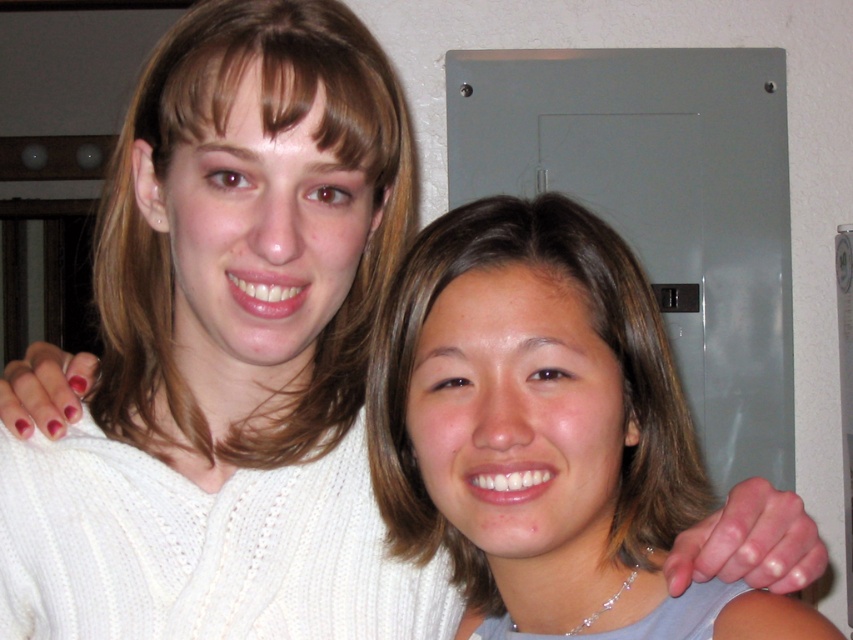
Question: Is the position of smooth brown hair at center more distant than that of blonde hair at upper left?

Choices:
 (A) no
 (B) yes

Answer: (A)

Question: Does smooth brown hair at center appear under blonde hair at upper left?

Choices:
 (A) yes
 (B) no

Answer: (A)

Question: Is smooth brown hair at center to the left of blonde hair at upper left from the viewer's perspective?

Choices:
 (A) no
 (B) yes

Answer: (A)